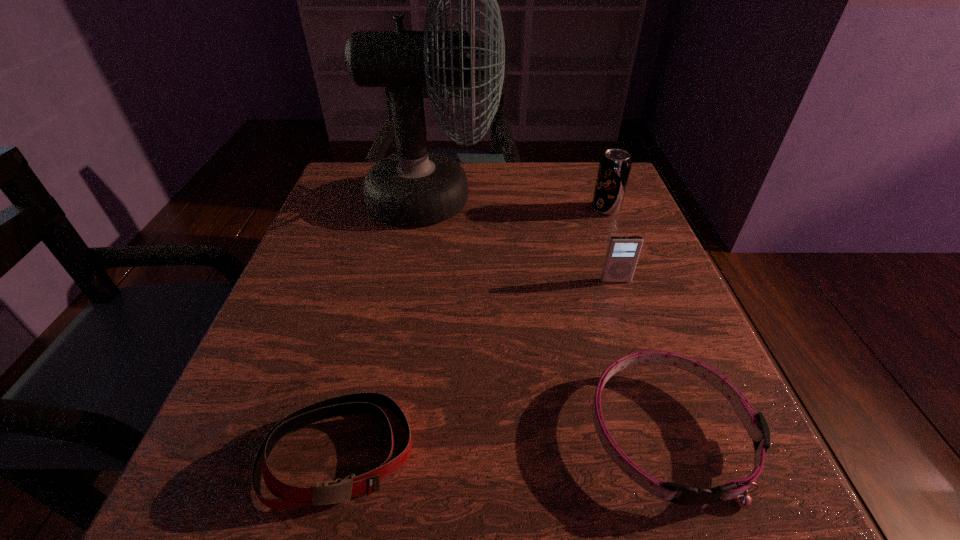
Where is `fan located at the far edge`? The width and height of the screenshot is (960, 540). fan located at the far edge is located at coordinates (414, 187).

I want to click on soda can positioned at the far edge, so click(614, 168).

Image resolution: width=960 pixels, height=540 pixels. Identify the location of fan that is at the left edge. (414, 187).

The width and height of the screenshot is (960, 540). In order to click on dog collar situated at the left edge in this screenshot , I will do `click(289, 496)`.

You are a GUI agent. You are given a task and a screenshot of the screen. Output one action in this format:
    pyautogui.click(x=<x>, y=<y>)
    Task: Click on the soda can that is at the right edge
    
    Given the screenshot: What is the action you would take?
    pyautogui.click(x=614, y=168)

Locate an element on the screen. Image resolution: width=960 pixels, height=540 pixels. iPod that is positioned at the right edge is located at coordinates 622,253.

Identify the location of dog collar at the right edge. The image size is (960, 540). (756, 425).

I want to click on object located in the far left corner section of the desktop, so click(414, 187).

Locate an element on the screen. The image size is (960, 540). object that is positioned at the near left corner is located at coordinates (289, 496).

Locate an element on the screen. The image size is (960, 540). object that is positioned at the far right corner is located at coordinates (614, 168).